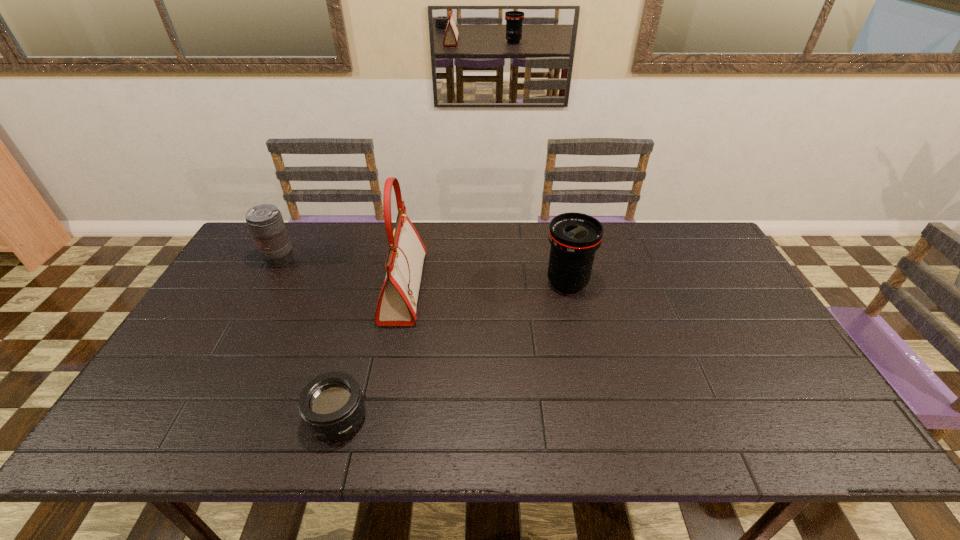
Find the location of a particular element. object positioned at the near edge is located at coordinates (331, 405).

Find the location of a particular element. This screenshot has width=960, height=540. object that is at the left edge is located at coordinates (265, 221).

This screenshot has height=540, width=960. I want to click on object at the far left corner, so click(x=265, y=221).

At what (x,y) coordinates should I click in order to perform the action: click on vacant space at the far edge of the desktop. Please return your answer as a coordinate pair (x, y). Looking at the image, I should click on (316, 242).

I want to click on free space at the near edge of the desktop, so click(x=486, y=444).

Find the location of a particular element. The height and width of the screenshot is (540, 960). vacant space at the left edge of the desktop is located at coordinates (148, 409).

Locate an element on the screen. vacant space at the far left corner of the desktop is located at coordinates (303, 221).

Find the location of a particular element. vacant point at the far right corner is located at coordinates (701, 238).

This screenshot has width=960, height=540. In the image, there is a desktop. Identify the location of free region at the near right corner. (771, 441).

Locate an element on the screen. The width and height of the screenshot is (960, 540). free spot between the rightmost telephoto lens and the tallest object is located at coordinates (486, 286).